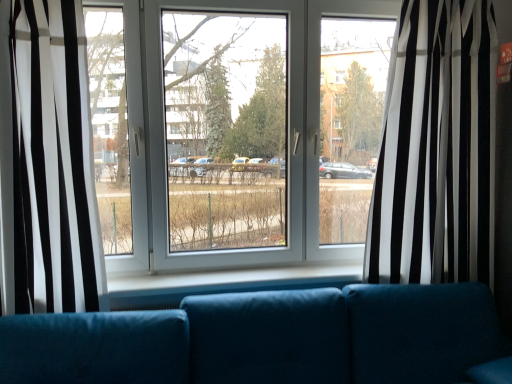
Question: Considering the relative sizes of teal fabric couch at center and white sheer curtain at left, which is the 2th curtain from right to left, in the image provided, is teal fabric couch at center bigger than white sheer curtain at left, which is the 2th curtain from right to left,?

Choices:
 (A) no
 (B) yes

Answer: (B)

Question: From a real-world perspective, is teal fabric couch at center on top of white sheer curtain at left, which is counted as the first curtain, starting from the left?

Choices:
 (A) yes
 (B) no

Answer: (B)

Question: Is teal fabric couch at center thinner than white sheer curtain at left, which is counted as the first curtain, starting from the left?

Choices:
 (A) yes
 (B) no

Answer: (B)

Question: Considering the relative sizes of teal fabric couch at center and white sheer curtain at left, which is counted as the first curtain, starting from the left, in the image provided, is teal fabric couch at center taller than white sheer curtain at left, which is counted as the first curtain, starting from the left,?

Choices:
 (A) no
 (B) yes

Answer: (A)

Question: Is white sheer curtain at left, which is counted as the first curtain, starting from the left, at the back of teal fabric couch at center?

Choices:
 (A) yes
 (B) no

Answer: (B)

Question: Can you confirm if teal fabric couch at center is shorter than white sheer curtain at left, which is counted as the first curtain, starting from the left?

Choices:
 (A) no
 (B) yes

Answer: (B)

Question: Considering the relative positions of black/white striped curtain at center, the 1th curtain in the right-to-left sequence, and white sheer curtain at left, which is counted as the first curtain, starting from the left, in the image provided, is black/white striped curtain at center, the 1th curtain in the right-to-left sequence, in front of white sheer curtain at left, which is counted as the first curtain, starting from the left,?

Choices:
 (A) no
 (B) yes

Answer: (A)

Question: Can we say black/white striped curtain at center, which is the 2th curtain from left to right, lies outside white sheer curtain at left, which is counted as the first curtain, starting from the left?

Choices:
 (A) yes
 (B) no

Answer: (A)

Question: From a real-world perspective, does black/white striped curtain at center, which is the 2th curtain from left to right, stand above white sheer curtain at left, which is counted as the first curtain, starting from the left?

Choices:
 (A) yes
 (B) no

Answer: (A)

Question: Is black/white striped curtain at center, the 1th curtain in the right-to-left sequence, turned away from white sheer curtain at left, which is the 2th curtain from right to left?

Choices:
 (A) yes
 (B) no

Answer: (B)

Question: Does black/white striped curtain at center, which is the 2th curtain from left to right, have a larger size compared to white sheer curtain at left, which is counted as the first curtain, starting from the left?

Choices:
 (A) no
 (B) yes

Answer: (B)

Question: Does black/white striped curtain at center, the 1th curtain in the right-to-left sequence, appear on the left side of white sheer curtain at left, which is counted as the first curtain, starting from the left?

Choices:
 (A) no
 (B) yes

Answer: (A)

Question: Is black/white striped curtain at center, the 1th curtain in the right-to-left sequence, surrounded by white sheer curtain at left, which is counted as the first curtain, starting from the left?

Choices:
 (A) yes
 (B) no

Answer: (B)